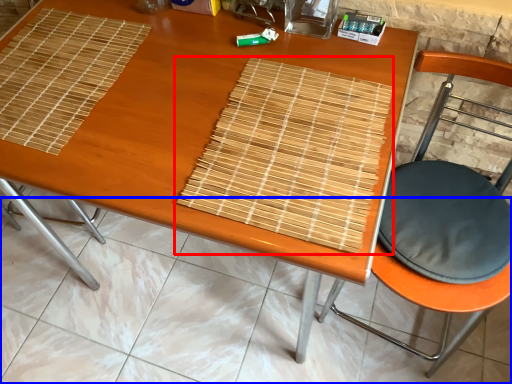
Question: Which of the following is the farthest to the observer, mat (highlighted by a red box) or tile (highlighted by a blue box)?

Choices:
 (A) mat
 (B) tile

Answer: (B)